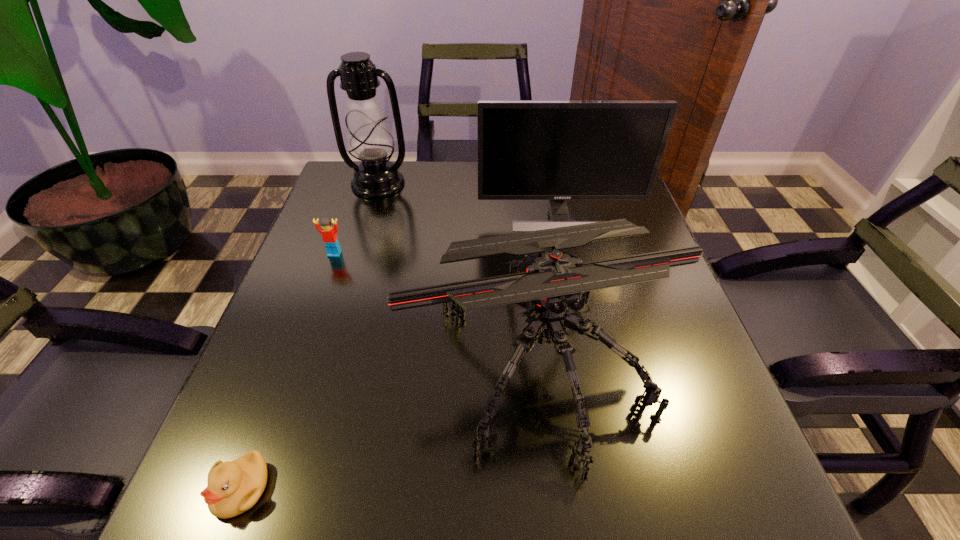
The image size is (960, 540). I want to click on object that is positioned at the near left corner, so click(x=233, y=487).

Where is `object situated at the far right corner`? object situated at the far right corner is located at coordinates (556, 150).

In order to click on object that is at the near right corner in this screenshot , I will do `click(548, 282)`.

Where is `vacant space at the far edge of the desktop`? This screenshot has height=540, width=960. vacant space at the far edge of the desktop is located at coordinates (463, 167).

Image resolution: width=960 pixels, height=540 pixels. What are the coordinates of `vacant space at the near edge` in the screenshot? It's located at (593, 475).

The image size is (960, 540). What are the coordinates of `vacant space at the left edge of the desktop` in the screenshot? It's located at (341, 312).

In the image, there is a desktop. Where is `free region at the right edge`? The width and height of the screenshot is (960, 540). free region at the right edge is located at coordinates (652, 307).

The width and height of the screenshot is (960, 540). I want to click on unoccupied area between the shortest object and the drone, so click(391, 424).

This screenshot has height=540, width=960. I want to click on free space that is in between the third farthest object and the oil lamp, so click(356, 219).

Find the location of a particular element. vacant area between the second farthest object and the Lego is located at coordinates (447, 235).